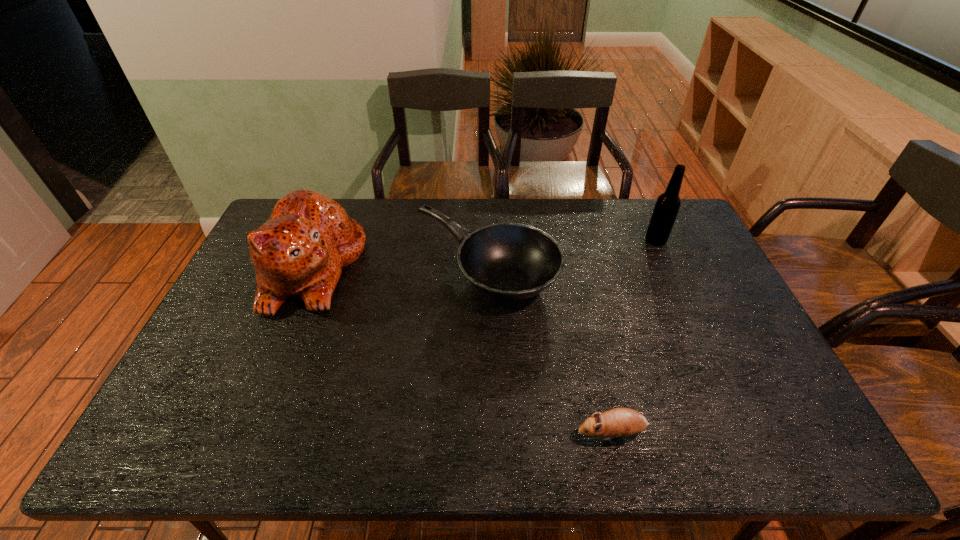
This screenshot has height=540, width=960. In order to click on vacant area that lies between the shortest object and the rightmost object in this screenshot , I will do `click(634, 336)`.

You are a GUI agent. You are given a task and a screenshot of the screen. Output one action in this format:
    pyautogui.click(x=<x>, y=<y>)
    Task: Click on the object that is the second closest to the leftmost object
    This screenshot has width=960, height=540.
    Given the screenshot: What is the action you would take?
    pyautogui.click(x=619, y=422)

Locate which object is the third closest to the third tallest object. Please provide its 2D coordinates. Your answer should be formatted as a tuple, i.e. [(x, y)], where the tuple contains the x and y coordinates of a point satisfying the conditions above.

[(667, 205)]

Locate an element on the screen. The height and width of the screenshot is (540, 960). vacant area that satisfies the following two spatial constraints: 1. on the front side of the rightmost object; 2. at the face of the nearest object is located at coordinates (743, 433).

Find the location of a particular element. vacant area that satisfies the following two spatial constraints: 1. on the face of the leftmost object; 2. on the right side of the frying pan is located at coordinates (312, 271).